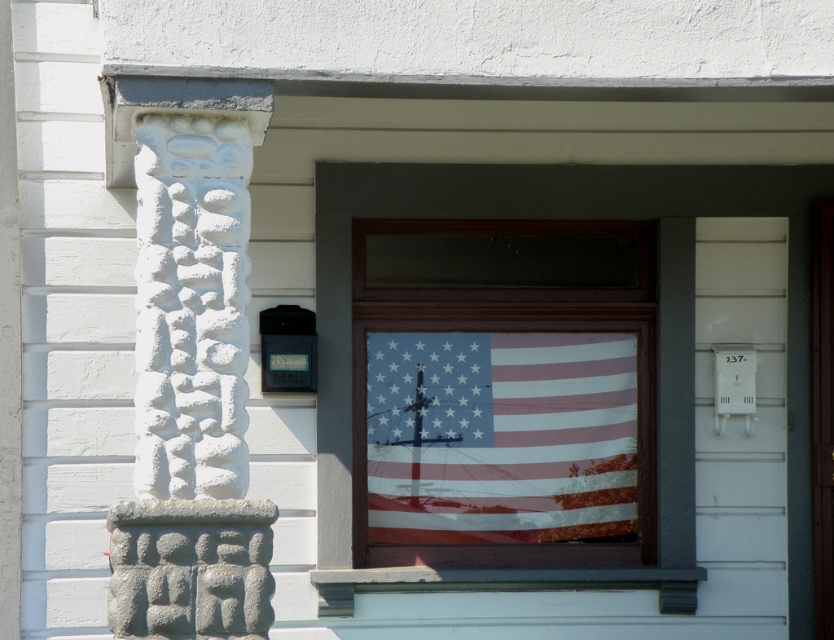
You are a window cleaner standing at the base of the building. You need to clean both the matte paper flag at center and the american flag at center. Which flag should you clean first if you want to start with the one closer to the window frame?

The matte paper flag at center and the american flag at center are 5.16 inches apart, but the exact distance between them isn not specified in terms of proximity to the window frame. Without additional information about their positions relative to the frame, it is impossible to determine which is closer.

You are a window cleaner who needs to clean both the matte paper flag at center and the american flag at center. Which flag should you clean first if you want to start with the one on the left?

The matte paper flag at center is positioned on the left side of the american flag at center, so you should clean the matte paper flag at center first.